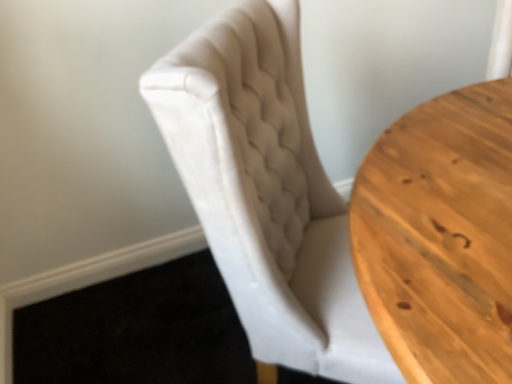
Question: Should I look upward or downward to see beige fabric chair at center?

Choices:
 (A) down
 (B) up

Answer: (A)